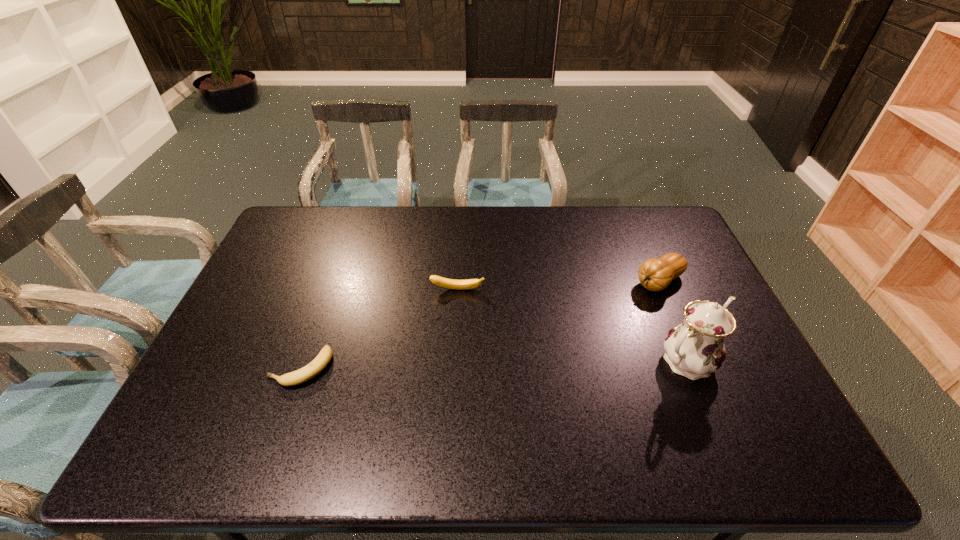
Identify the location of unoccupied position between the shorter banana and the chinaware. (493, 364).

Locate an element on the screen. The image size is (960, 540). blank region between the nearer banana and the farther banana is located at coordinates (379, 328).

Locate an element on the screen. The image size is (960, 540). object that is the second nearest to the tallest object is located at coordinates (440, 281).

Select which object appears as the second closest to the farther banana. Please provide its 2D coordinates. Your answer should be formatted as a tuple, i.e. [(x, y)], where the tuple contains the x and y coordinates of a point satisfying the conditions above.

[(655, 274)]

Find the location of a particular element. The image size is (960, 540). free space that satisfies the following two spatial constraints: 1. on the back side of the gourd; 2. on the right side of the leftmost object is located at coordinates (331, 281).

What are the coordinates of `free space that satisfies the following two spatial constraints: 1. on the back side of the leftmost object; 2. on the left side of the tallest object` in the screenshot? It's located at (303, 361).